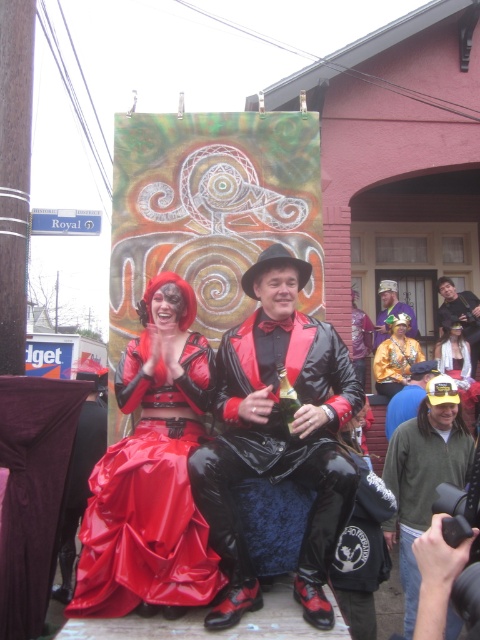
You are a photographer standing in front of the two jackets. You want to take a photo that includes both the green fleece jacket at lower right and the shiny black leather jacket at center. Which jacket should you focus on first to ensure both are in the frame?

You should focus on the shiny black leather jacket at center first because the green fleece jacket at lower right is closer to the viewer, so adjusting the camera to include both would require ensuring the closer jacket is positioned properly before framing the farther one.

You are a photographer trying to capture a photo of the two jackets in the scene. The green fleece jacket at lower right and the shiny black leather jacket at center are both in your viewfinder. Based on their sizes in the image, which jacket would appear larger in the photo?

The green fleece jacket at lower right might be wider than shiny black leather jacket at center, so it could appear larger in the photo depending on their actual sizes and distance from the camera.